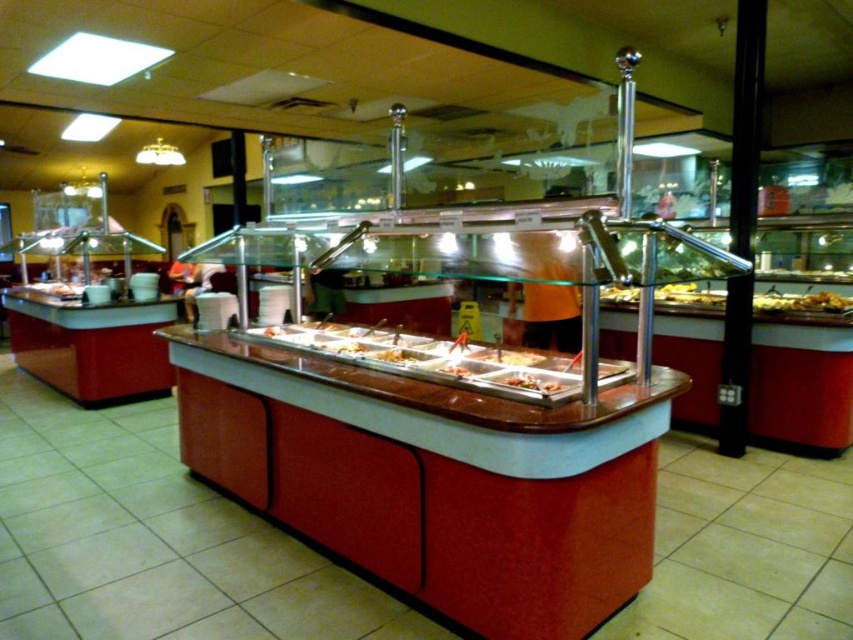
Question: Where is white glossy food at center located in relation to slightly browned plastic tray at center in the image?

Choices:
 (A) below
 (B) above

Answer: (A)

Question: Which point appears farthest from the camera in this image?

Choices:
 (A) (508, 376)
 (B) (445, 362)
 (C) (355, 340)
 (D) (519, 358)

Answer: (C)

Question: Estimate the real-world distances between objects in this image. Which object is closer to the white plastic tray at center?

Choices:
 (A) slightly browned plastic tray at center
 (B) yellow matte food at center

Answer: (A)

Question: Is yellow matte food at center thinner than slightly browned plastic tray at center?

Choices:
 (A) yes
 (B) no

Answer: (B)

Question: Estimate the real-world distances between objects in this image. Which object is farther from the white plastic tray at center?

Choices:
 (A) yellow matte food at center
 (B) white glossy tray at center
 (C) slightly browned plastic tray at center

Answer: (A)

Question: Is white glossy food at center smaller than yellow matte food at center?

Choices:
 (A) yes
 (B) no

Answer: (B)